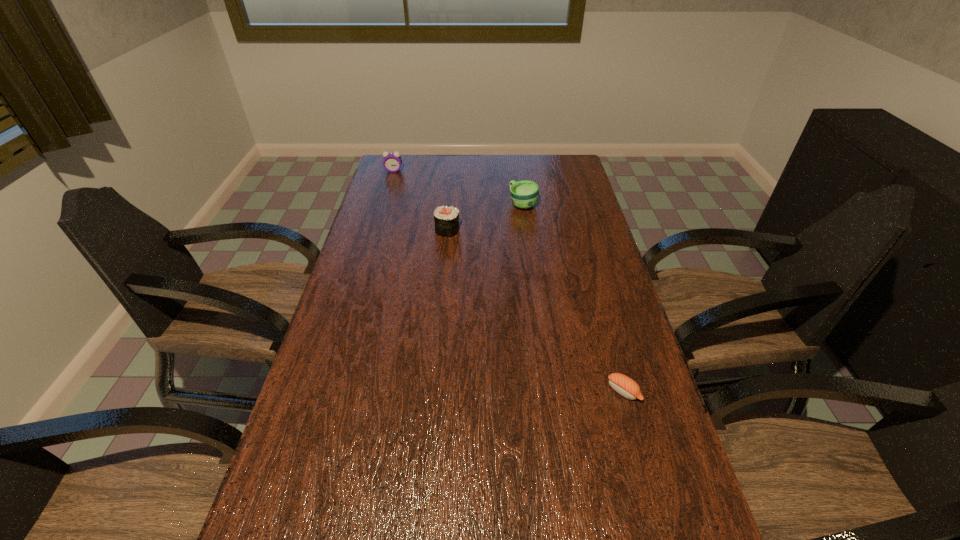
At what (x,y) coordinates should I click in order to perform the action: click on vacant area situated on the back of the third nearest object. Please return your answer as a coordinate pair (x, y). Looking at the image, I should click on (520, 185).

Identify the location of free space located 0.140m on the front of the nearest object. The width and height of the screenshot is (960, 540). (644, 463).

Identify the location of object that is at the far edge. (392, 162).

The image size is (960, 540). What are the coordinates of `object that is at the left edge` in the screenshot? It's located at (392, 162).

You are a GUI agent. You are given a task and a screenshot of the screen. Output one action in this format:
    pyautogui.click(x=<x>, y=<y>)
    Task: Click on the object located at the right edge
    This screenshot has width=960, height=540.
    Given the screenshot: What is the action you would take?
    pyautogui.click(x=622, y=384)

At what (x,y) coordinates should I click in order to perform the action: click on object located at the far left corner. Please return your answer as a coordinate pair (x, y). This screenshot has height=540, width=960. Looking at the image, I should click on coord(392,162).

At what (x,y) coordinates should I click in order to perform the action: click on vacant space at the far edge of the desktop. Please return your answer as a coordinate pair (x, y). The width and height of the screenshot is (960, 540). Looking at the image, I should click on (470, 159).

You are a GUI agent. You are given a task and a screenshot of the screen. Output one action in this format:
    pyautogui.click(x=<x>, y=<y>)
    Task: Click on the free spot at the left edge of the desktop
    
    Given the screenshot: What is the action you would take?
    pyautogui.click(x=335, y=414)

This screenshot has height=540, width=960. I want to click on vacant region at the right edge, so click(x=616, y=354).

The height and width of the screenshot is (540, 960). In order to click on free space at the far left corner of the desktop in this screenshot , I will do `click(383, 177)`.